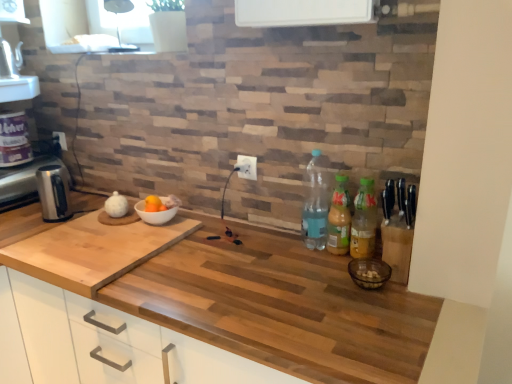
Question: Does satin silver kettle at left lie behind translucent plastic bottle at right, which is the third bottle in right-to-left order?

Choices:
 (A) yes
 (B) no

Answer: (A)

Question: Does satin silver kettle at left have a greater height compared to translucent plastic bottle at right, which ranks as the 1th bottle in left-to-right order?

Choices:
 (A) no
 (B) yes

Answer: (A)

Question: Considering the relative sizes of satin silver kettle at left and translucent plastic bottle at right, which ranks as the 1th bottle in left-to-right order, in the image provided, is satin silver kettle at left bigger than translucent plastic bottle at right, which ranks as the 1th bottle in left-to-right order,?

Choices:
 (A) no
 (B) yes

Answer: (B)

Question: Does satin silver kettle at left appear on the left side of translucent plastic bottle at right, which ranks as the 1th bottle in left-to-right order?

Choices:
 (A) yes
 (B) no

Answer: (A)

Question: Does satin silver kettle at left turn towards translucent plastic bottle at right, which is the third bottle in right-to-left order?

Choices:
 (A) no
 (B) yes

Answer: (A)

Question: Considering the relative sizes of satin silver kettle at left and translucent plastic bottle at right, which ranks as the 1th bottle in left-to-right order, in the image provided, is satin silver kettle at left smaller than translucent plastic bottle at right, which ranks as the 1th bottle in left-to-right order,?

Choices:
 (A) yes
 (B) no

Answer: (B)

Question: Is translucent plastic bottle at right, which is the third bottle in right-to-left order, bigger than white plastic electric outlet at center, arranged as the first electric outlet when viewed from the right?

Choices:
 (A) no
 (B) yes

Answer: (B)

Question: Can you confirm if translucent plastic bottle at right, which is the third bottle in right-to-left order, is positioned to the right of white plastic electric outlet at center, the second electric outlet positioned from the back?

Choices:
 (A) yes
 (B) no

Answer: (A)

Question: From a real-world perspective, is translucent plastic bottle at right, which is the third bottle in right-to-left order, over white plastic electric outlet at center, the second electric outlet positioned from the left?

Choices:
 (A) no
 (B) yes

Answer: (A)

Question: Can you confirm if translucent plastic bottle at right, which is the third bottle in right-to-left order, is shorter than white plastic electric outlet at center, the second electric outlet positioned from the left?

Choices:
 (A) no
 (B) yes

Answer: (A)

Question: Can you confirm if translucent plastic bottle at right, which is the third bottle in right-to-left order, is smaller than white plastic electric outlet at center, which ranks as the 1th electric outlet in front-to-back order?

Choices:
 (A) yes
 (B) no

Answer: (B)

Question: From a real-world perspective, is translucent plastic bottle at right, which is the third bottle in right-to-left order, physically below white plastic electric outlet at center, which is the second electric outlet from top to bottom?

Choices:
 (A) no
 (B) yes

Answer: (B)

Question: Does white plastic electric outlet at upper center, the second electric outlet from the front, have a greater height compared to white plastic electric outlet at center, which is the second electric outlet from top to bottom?

Choices:
 (A) no
 (B) yes

Answer: (A)